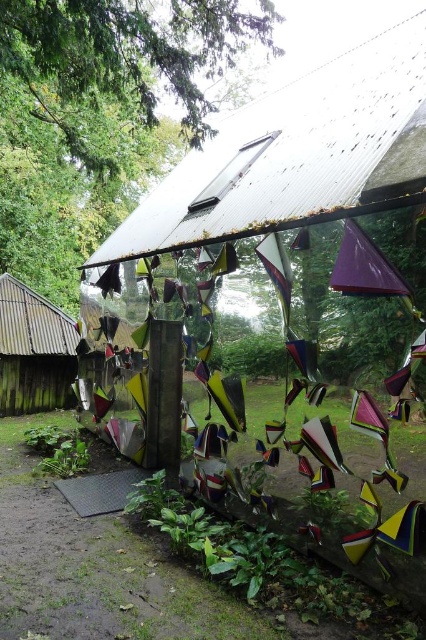
Question: Does green leafy tree at upper left come in front of wooden shingles hut at left?

Choices:
 (A) no
 (B) yes

Answer: (B)

Question: Does green leafy tree at upper left have a greater width compared to wooden shingles hut at left?

Choices:
 (A) yes
 (B) no

Answer: (A)

Question: Which of the following is the farthest from the observer?

Choices:
 (A) (97, 188)
 (B) (43, 348)

Answer: (A)

Question: Which of the following is the closest to the observer?

Choices:
 (A) green leafy tree at upper left
 (B) wooden shingles hut at left

Answer: (A)

Question: Does green leafy tree at upper left have a lesser width compared to wooden shingles hut at left?

Choices:
 (A) no
 (B) yes

Answer: (A)